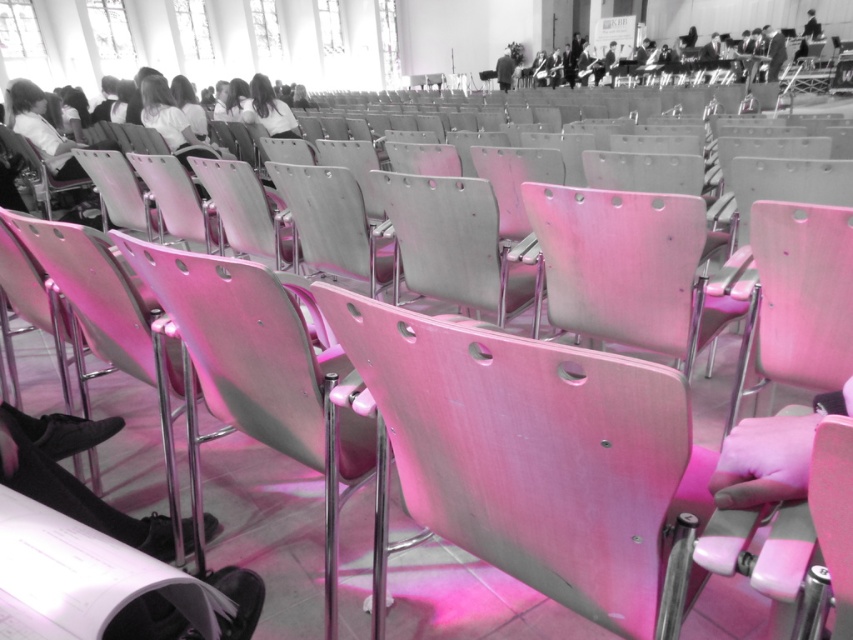
Question: Which object is closer to the camera taking this photo?

Choices:
 (A) black leather shoes at lower left
 (B) black fabric jacket at upper center

Answer: (A)

Question: Is black leather shoes at lower left in front of metallic silver person at center?

Choices:
 (A) yes
 (B) no

Answer: (A)

Question: Does black leather shoes at lower left appear under dark gray suit at upper right?

Choices:
 (A) yes
 (B) no

Answer: (A)

Question: Which object is the closest to the metallic silver person at center?

Choices:
 (A) black leather shoes at lower left
 (B) black fabric jacket at upper center
 (C) smooth hair at center
 (D) pink leather gloves at lower right

Answer: (B)

Question: Considering the real-world distances, which object is closest to the black leather shoes at lower left?

Choices:
 (A) dark gray suit at upper right
 (B) metallic silver person at center
 (C) pink leather gloves at lower right

Answer: (C)

Question: Is pink leather gloves at lower right bigger than dark gray suit at upper right?

Choices:
 (A) no
 (B) yes

Answer: (A)